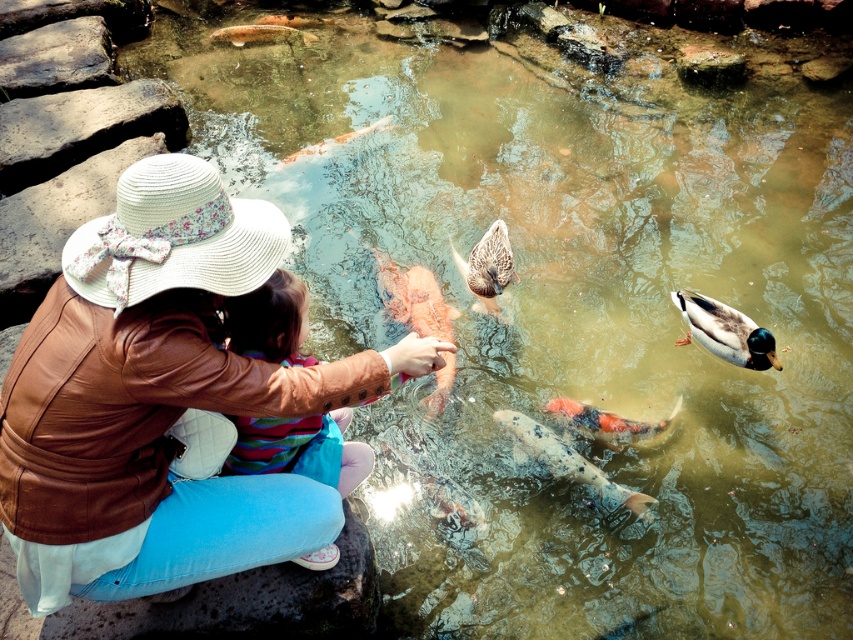
Question: Is orange textured fish at center closer to the viewer compared to speckled orange fish at center?

Choices:
 (A) yes
 (B) no

Answer: (B)

Question: Which point is closer to the camera?

Choices:
 (A) shiny orange fish at center
 (B) greenish-brown feathers duck at center

Answer: (B)

Question: Which point is farther to the camera?

Choices:
 (A) (306, 24)
 (B) (268, 321)
 (C) (42, 476)

Answer: (A)

Question: Among these points, which one is farthest from the camera?

Choices:
 (A) (674, 292)
 (B) (268, 19)

Answer: (B)

Question: Can you confirm if brown leather jacket at lower left is thinner than greenish-brown feathers duck at center?

Choices:
 (A) yes
 (B) no

Answer: (B)

Question: Does striped fabric dress at center appear under brown feathered duck at center?

Choices:
 (A) yes
 (B) no

Answer: (A)